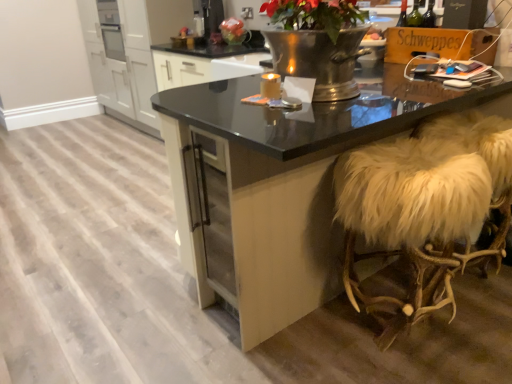
Question: Is black glossy table at center to the left of matte gold candle at center from the viewer's perspective?

Choices:
 (A) no
 (B) yes

Answer: (A)

Question: From the image's perspective, is black glossy table at center above matte gold candle at center?

Choices:
 (A) no
 (B) yes

Answer: (A)

Question: Is black glossy table at center further to the viewer compared to matte gold candle at center?

Choices:
 (A) yes
 (B) no

Answer: (B)

Question: Considering the relative sizes of black glossy table at center and matte gold candle at center in the image provided, is black glossy table at center taller than matte gold candle at center?

Choices:
 (A) yes
 (B) no

Answer: (A)

Question: Is black glossy table at center thinner than matte gold candle at center?

Choices:
 (A) no
 (B) yes

Answer: (A)

Question: Can you confirm if black glossy table at center is positioned to the right of matte gold candle at center?

Choices:
 (A) yes
 (B) no

Answer: (A)

Question: Is black glossy table at center to the right of white fur-covered stool at right from the viewer's perspective?

Choices:
 (A) no
 (B) yes

Answer: (A)

Question: Is black glossy table at center smaller than white fur-covered stool at right?

Choices:
 (A) no
 (B) yes

Answer: (A)

Question: Is black glossy table at center looking in the opposite direction of white fur-covered stool at right?

Choices:
 (A) no
 (B) yes

Answer: (B)

Question: Is the position of black glossy table at center less distant than that of white fur-covered stool at right?

Choices:
 (A) yes
 (B) no

Answer: (A)

Question: Considering the relative sizes of black glossy table at center and white fur-covered stool at right in the image provided, is black glossy table at center thinner than white fur-covered stool at right?

Choices:
 (A) no
 (B) yes

Answer: (A)

Question: Considering the relative sizes of black glossy table at center and white fur-covered stool at right in the image provided, is black glossy table at center taller than white fur-covered stool at right?

Choices:
 (A) yes
 (B) no

Answer: (A)

Question: Can you confirm if white fur-covered stool at right is wider than matte plastic bag at upper center?

Choices:
 (A) no
 (B) yes

Answer: (B)